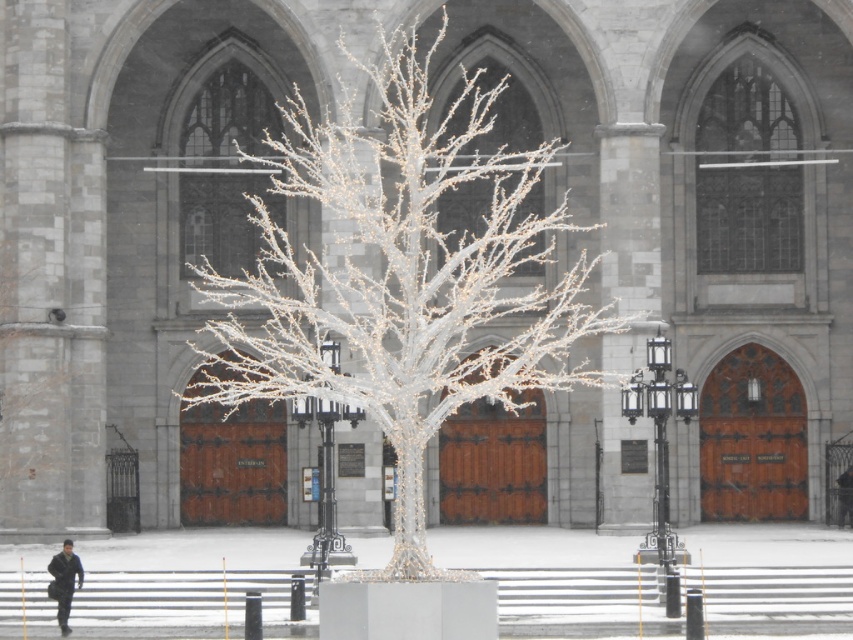
Question: Does icy white branches at center have a lesser width compared to dark blue uniform at lower left?

Choices:
 (A) yes
 (B) no

Answer: (B)

Question: Does icy white branches at center appear on the left side of dark blue uniform at lower left?

Choices:
 (A) yes
 (B) no

Answer: (B)

Question: Which object appears closest to the camera in this image?

Choices:
 (A) icy white branches at center
 (B) dark blue uniform at lower left

Answer: (A)

Question: Is icy white branches at center closer to camera compared to dark blue uniform at lower left?

Choices:
 (A) no
 (B) yes

Answer: (B)